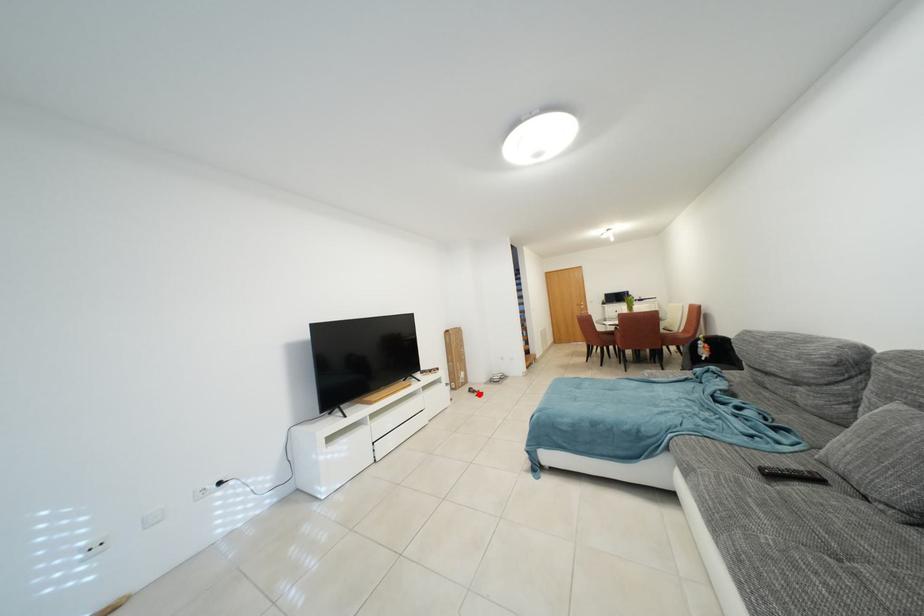
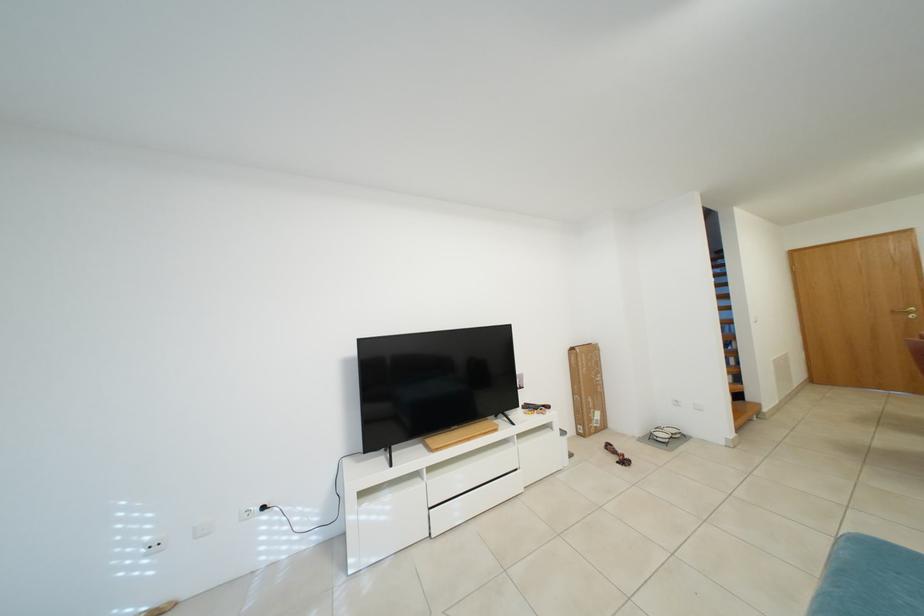
Question: A red point is marked in image1. In image2, is the corresponding 3D point closer to the camera or farther? Reply with the corresponding letter.

Choices:
 (A) The corresponding 3D point is closer.
 (B) The corresponding 3D point is farther.

Answer: (A)